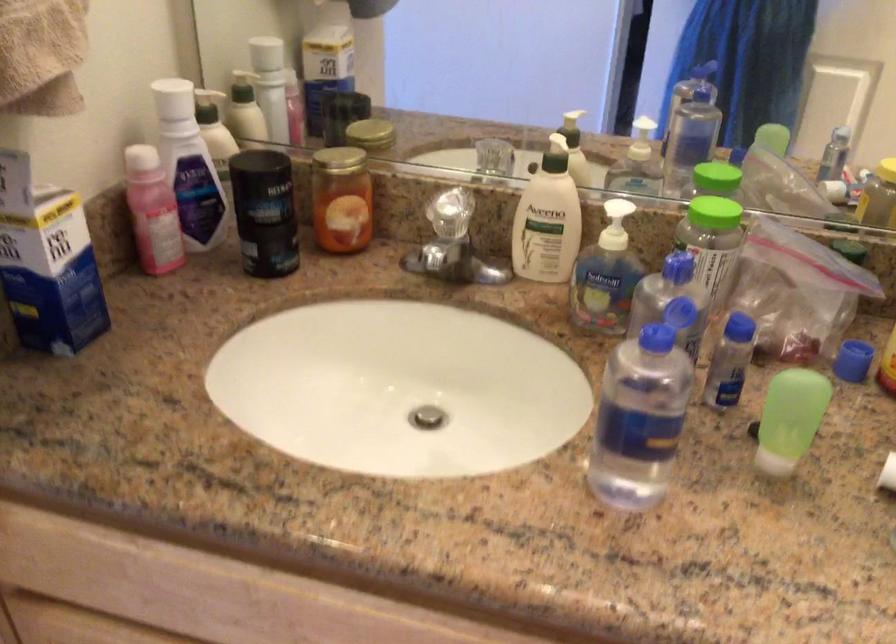
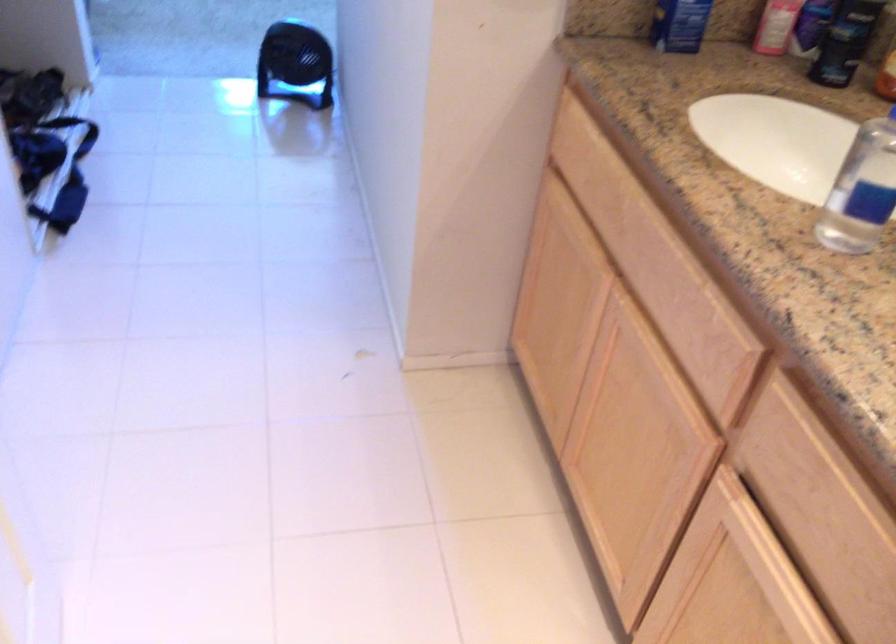
First-person continuous shooting, in which direction is the camera rotating?

The camera rotated toward left-down.